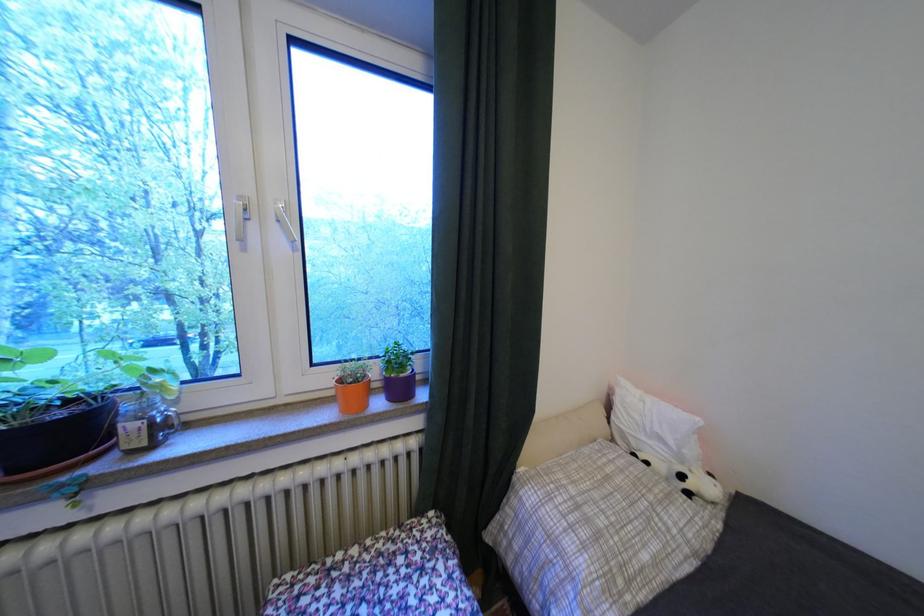
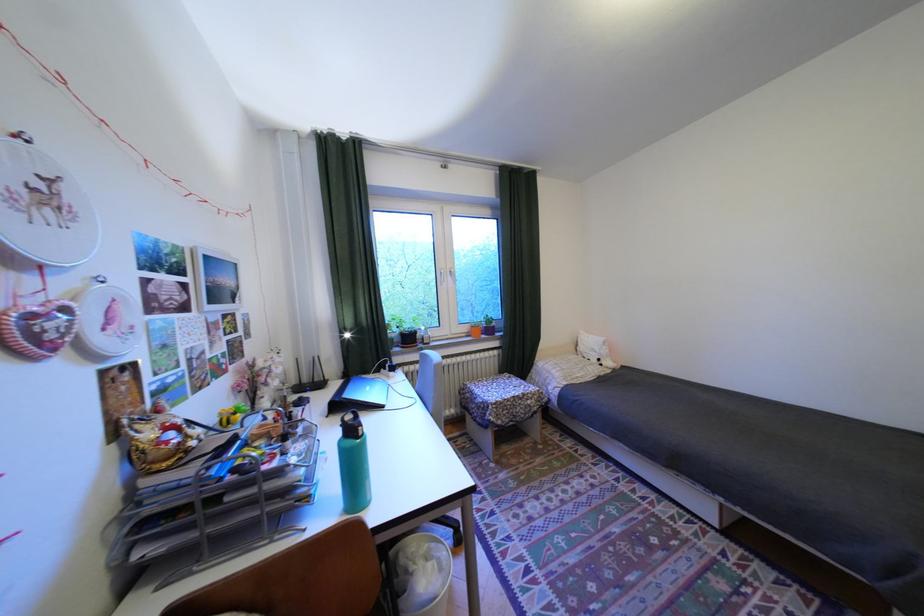
Question: The images are taken continuously from a first-person perspective. In which direction are you moving?

Choices:
 (A) Left
 (B) Right
 (C) Forward
 (D) Backward

Answer: (D)